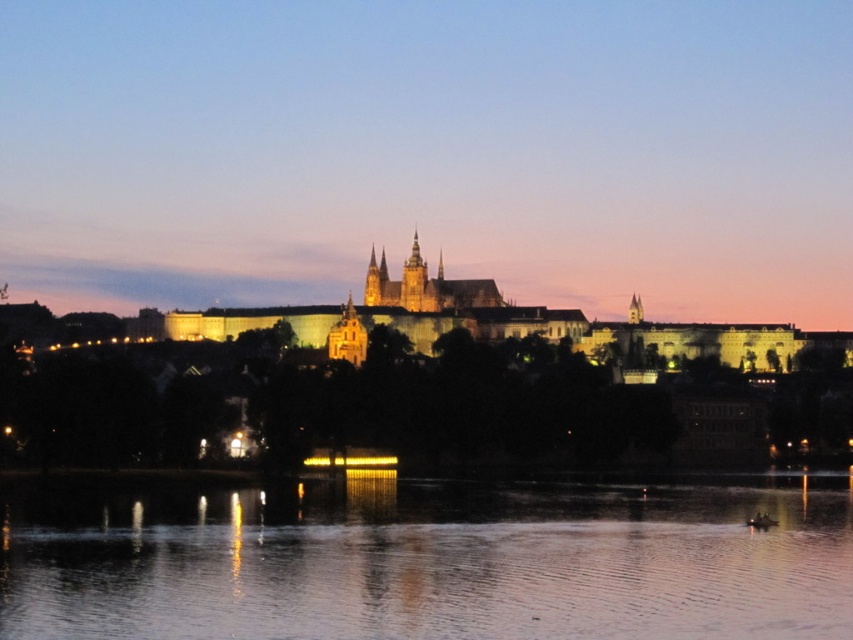
Question: Can you confirm if smooth reflective water at lower center is positioned below illuminated stone castle at center?

Choices:
 (A) no
 (B) yes

Answer: (B)

Question: Considering the relative positions of smooth reflective water at lower center and illuminated stone castle at center in the image provided, where is smooth reflective water at lower center located with respect to illuminated stone castle at center?

Choices:
 (A) below
 (B) above

Answer: (A)

Question: Which point is closer to the camera?

Choices:
 (A) illuminated stone castle at center
 (B) smooth reflective water at lower center

Answer: (B)

Question: Which of the following is the closest to the observer?

Choices:
 (A) (549, 524)
 (B) (781, 330)

Answer: (A)

Question: Is smooth reflective water at lower center further to camera compared to illuminated stone castle at center?

Choices:
 (A) no
 (B) yes

Answer: (A)